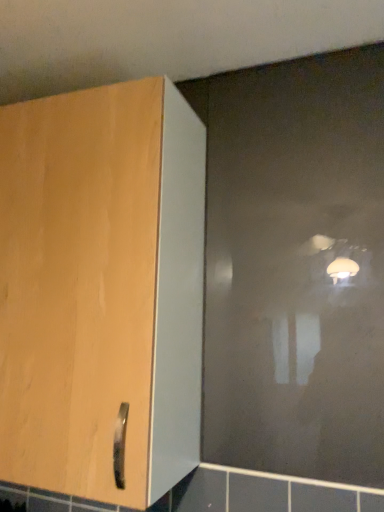
Question: From the image's perspective, is transparent matte glass door at upper right positioned above or below matte wood cupboard at left?

Choices:
 (A) below
 (B) above

Answer: (B)

Question: Based on their sizes in the image, would you say transparent matte glass door at upper right is bigger or smaller than matte wood cupboard at left?

Choices:
 (A) small
 (B) big

Answer: (A)

Question: Based on their relative distances, which object is nearer to the matte ceramic tile at lower left?

Choices:
 (A) matte wood cupboard at left
 (B) transparent matte glass door at upper right

Answer: (A)

Question: Which object is the closest to the transparent matte glass door at upper right?

Choices:
 (A) matte ceramic tile at lower left
 (B) matte wood cupboard at left

Answer: (B)